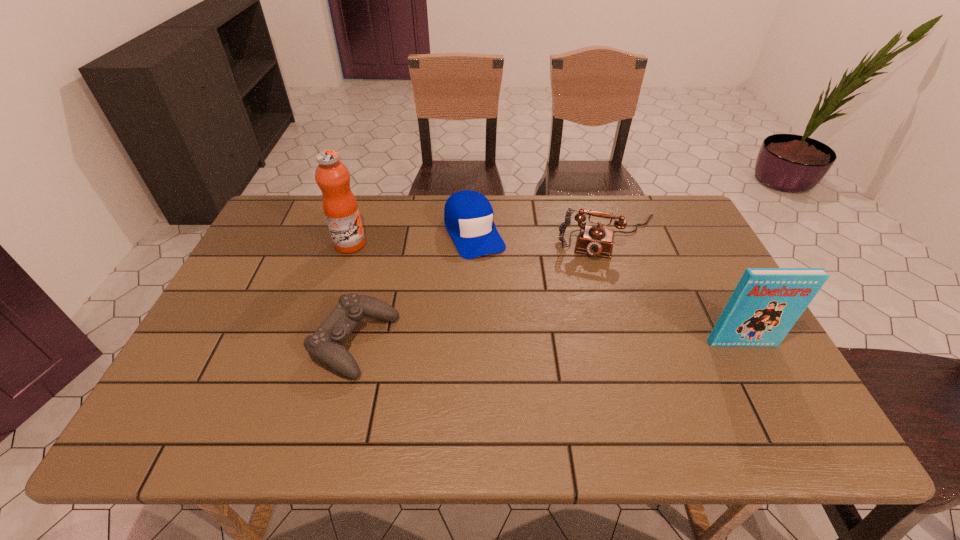
Locate an element on the screen. This screenshot has width=960, height=540. blank space located 0.370m on the dial of the telephone is located at coordinates (588, 363).

Where is `vacant region located on the front label of the fruit juice`? Image resolution: width=960 pixels, height=540 pixels. vacant region located on the front label of the fruit juice is located at coordinates (423, 284).

Image resolution: width=960 pixels, height=540 pixels. I want to click on vacant position located on the front label of the fruit juice, so click(x=458, y=303).

Where is `vacant area situated on the front label of the fruit juice`? vacant area situated on the front label of the fruit juice is located at coordinates (375, 258).

This screenshot has height=540, width=960. Find the location of `free point located 0.220m on the front-facing side of the third object from left to right`. free point located 0.220m on the front-facing side of the third object from left to right is located at coordinates (512, 311).

Identify the location of vacant area situated on the front-facing side of the third object from left to right. (511, 308).

The image size is (960, 540). What are the coordinates of `free space located on the front-facing side of the third object from left to right` in the screenshot? It's located at (515, 316).

Where is `telephone present at the far edge`? telephone present at the far edge is located at coordinates (595, 240).

Find the location of a particular element. The image size is (960, 540). fruit juice present at the far edge is located at coordinates (340, 206).

This screenshot has width=960, height=540. In order to click on baseball cap located in the far edge section of the desktop in this screenshot , I will do `click(468, 215)`.